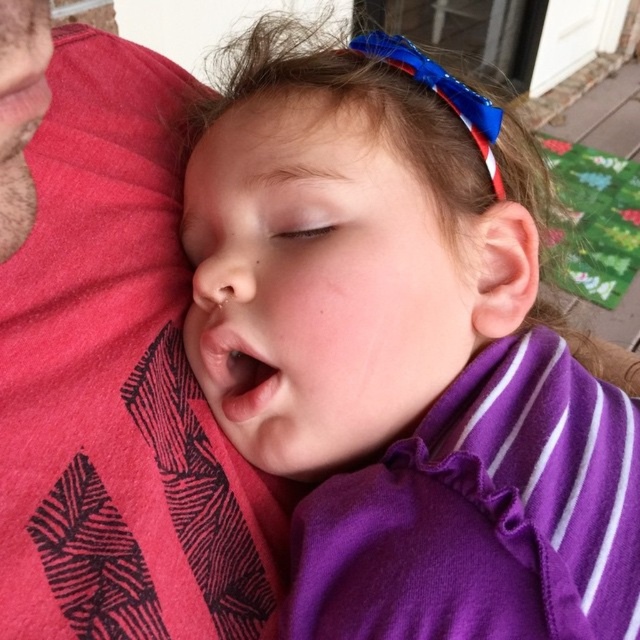
Question: Which object is farther from the camera taking this photo?

Choices:
 (A) purple fabric at center
 (B) pink fabric at left
 (C) smooth skin at upper center

Answer: (C)

Question: Which of the following is the farthest from the observer?

Choices:
 (A) (86, 234)
 (B) (220, 285)

Answer: (A)

Question: Does pink fabric at left have a greater width compared to smooth skin at upper center?

Choices:
 (A) yes
 (B) no

Answer: (A)

Question: Can you confirm if pink fabric at left is smaller than smooth skin at upper center?

Choices:
 (A) no
 (B) yes

Answer: (A)

Question: Does purple fabric at center have a lesser width compared to pink fabric at left?

Choices:
 (A) yes
 (B) no

Answer: (B)

Question: Based on their relative distances, which object is nearer to the pink fabric at left?

Choices:
 (A) smooth skin at upper center
 (B) smooth skin face at center
 (C) purple fabric at center

Answer: (B)